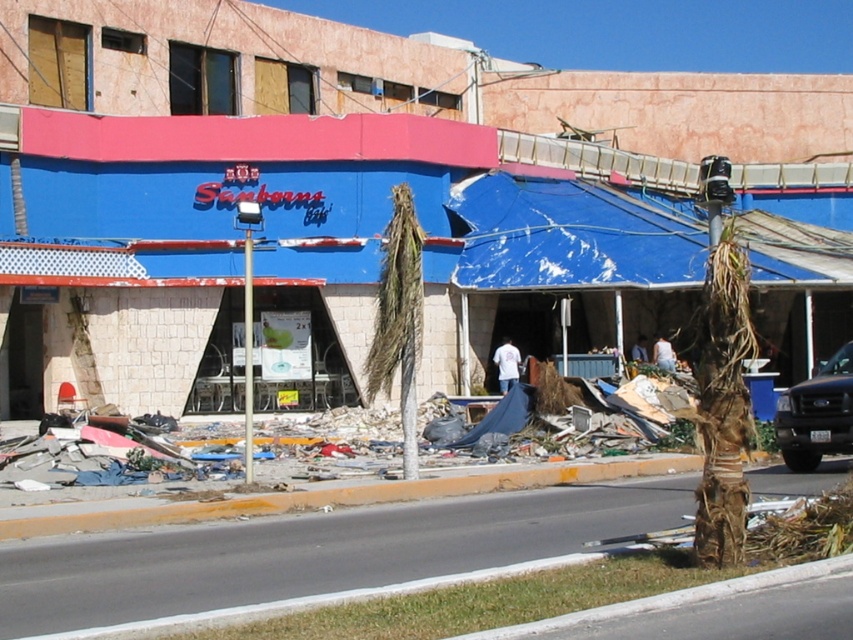
You are a disaster relief worker assessing the damage to the Sanborns store. You notice a point marked at coordinates (x=300, y=244). What object is located at this point?

The point at coordinates (x=300, y=244) marks the location of the blue tarpaulin awning at center.

You are standing in front of the damaged Sanborns store. There are two points marked on the ground in front of the building. The first point is at coordinate (30, 259) and the second is at (842, 385). If you were to walk from the first point to the second point, would you be moving towards the building or away from it?

Moving away from the building. Since point (30, 259) is closer to the viewer than point (842, 385), walking from the first to the second point means moving away from the building.

You are a delivery driver who needs to park your truck next to the blue tarpaulin awning at center. Based on the scene, can your black matte truck at right fit under the awning without hitting it?

The blue tarpaulin awning at center is much taller than the black matte truck at right, so the truck can fit under the awning without any issues.